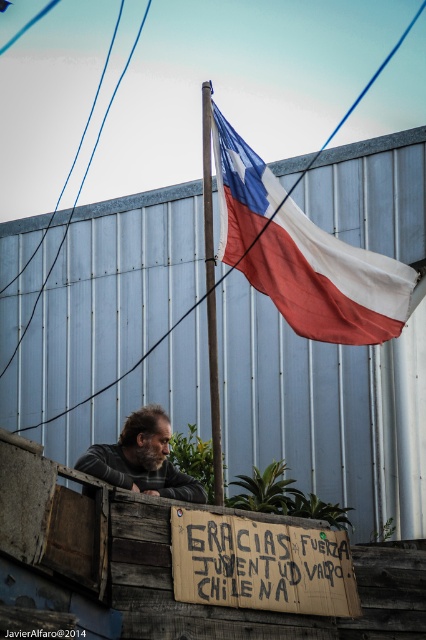
You are a photographer trying to capture the scene with the gray fabric shirt at lower left and the wooden pole at upper center. To ensure both are in frame, which object should you position closer to the center of your camera viewfinder first?

The wooden pole at upper center should be positioned closer to the center first because the gray fabric shirt at lower left is on its right side, so centering the pole will help frame both objects effectively.